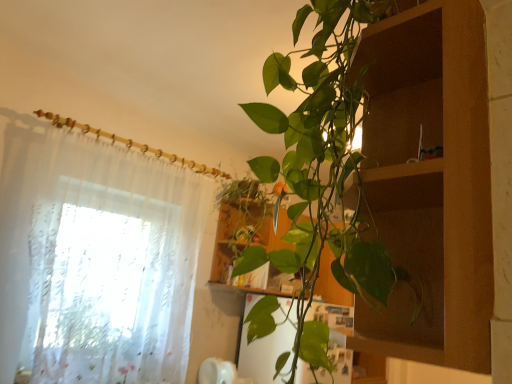
Question: Is sheer white curtain at left taller or shorter than wooden cabinet at center?

Choices:
 (A) tall
 (B) short

Answer: (A)

Question: Looking at their shapes, would you say sheer white curtain at left is wider or thinner than wooden cabinet at center?

Choices:
 (A) thin
 (B) wide

Answer: (A)

Question: Is point (52, 327) closer or farther from the camera than point (348, 301)?

Choices:
 (A) farther
 (B) closer

Answer: (B)

Question: In terms of width, does wooden cabinet at center look wider or thinner when compared to sheer white curtain at left?

Choices:
 (A) thin
 (B) wide

Answer: (B)

Question: Would you say wooden cabinet at center is to the left or to the right of sheer white curtain at left in the picture?

Choices:
 (A) right
 (B) left

Answer: (A)

Question: Based on their sizes in the image, would you say wooden cabinet at center is bigger or smaller than sheer white curtain at left?

Choices:
 (A) small
 (B) big

Answer: (A)

Question: From the image's perspective, relative to sheer white curtain at left, is wooden cabinet at center above or below?

Choices:
 (A) below
 (B) above

Answer: (A)